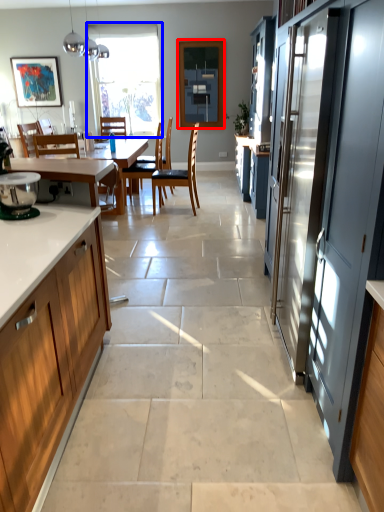
Question: Which of the following is the farthest to the observer, window screen (highlighted by a red box) or window (highlighted by a blue box)?

Choices:
 (A) window screen
 (B) window

Answer: (B)